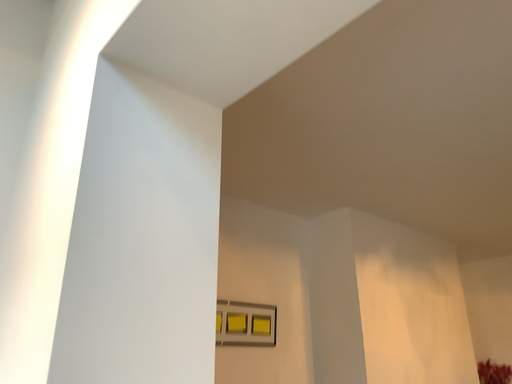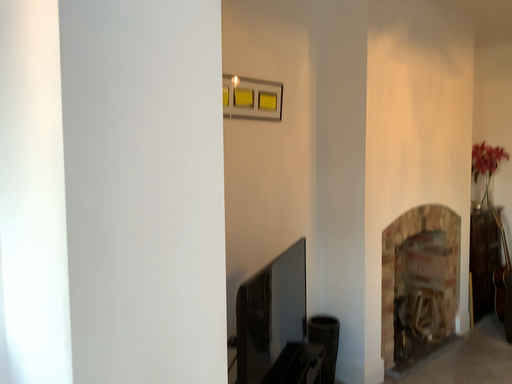
Question: How did the camera likely rotate when shooting the video?

Choices:
 (A) rotated downward
 (B) rotated upward

Answer: (A)